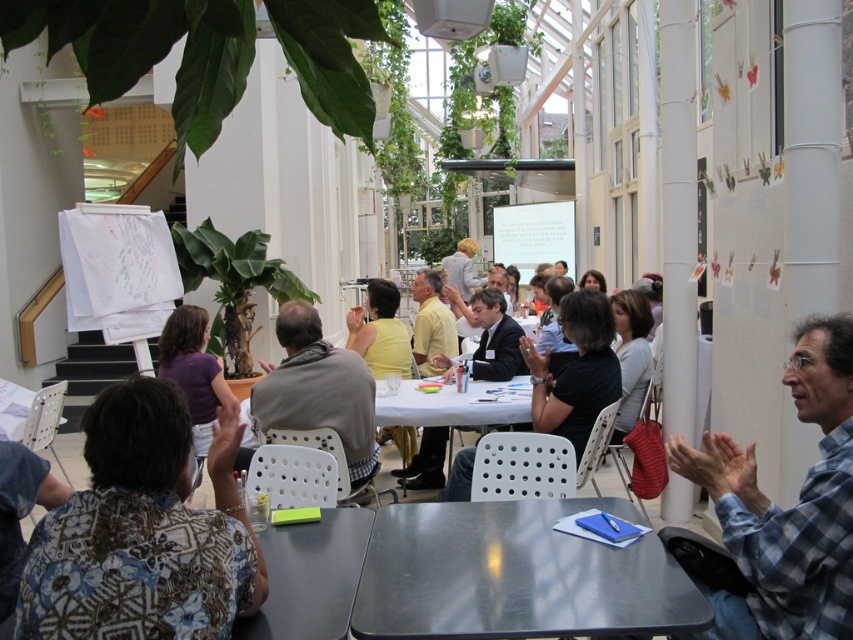
Between blue plaid shirt at center and white plastic table at center, which one has more height?

blue plaid shirt at center

The height and width of the screenshot is (640, 853). I want to click on blue plaid shirt at center, so [788, 508].

Is point (848, 538) positioned before point (409, 400)?

Yes, it is.

Image resolution: width=853 pixels, height=640 pixels. Find the location of `blue plaid shirt at center`. blue plaid shirt at center is located at coordinates [x=788, y=508].

Between floral fabric shirt at lower left and white plastic table at center, which one has more height?

With more height is floral fabric shirt at lower left.

This screenshot has height=640, width=853. Identify the location of floral fabric shirt at lower left. (143, 531).

Which is below, gray fabric jacket at center or white plastic table at center?

gray fabric jacket at center

Based on the photo, between gray fabric jacket at center and white plastic table at center, which one has less height?

white plastic table at center is shorter.

The image size is (853, 640). What are the coordinates of `gray fabric jacket at center` in the screenshot? It's located at (317, 388).